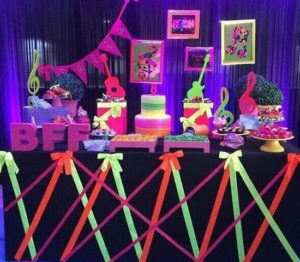
Image resolution: width=300 pixels, height=262 pixels. What are the coordinates of `picture` in the screenshot? It's located at (193, 28).